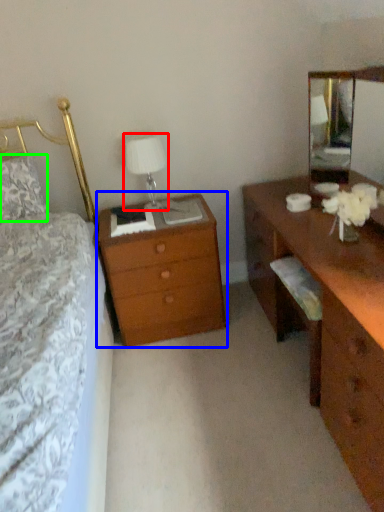
Question: Based on their relative distances, which object is nearer to table lamp (highlighted by a red box)? Choose from nightstand (highlighted by a blue box) and pillow (highlighted by a green box).

Choices:
 (A) nightstand
 (B) pillow

Answer: (A)